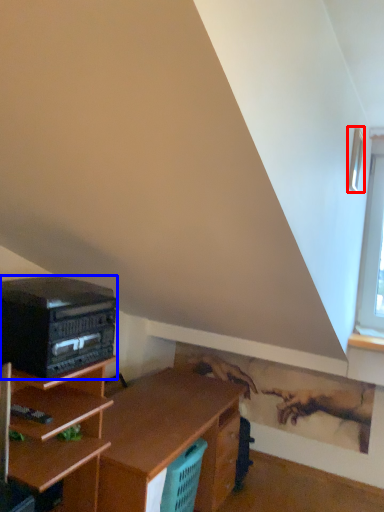
Question: Which object appears farthest to the camera in this image, window (highlighted by a red box) or stereo (highlighted by a blue box)?

Choices:
 (A) window
 (B) stereo

Answer: (A)